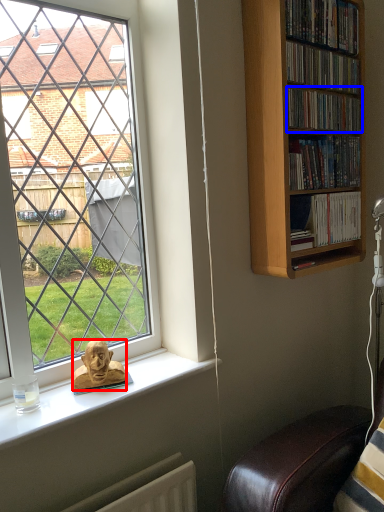
Question: Which point is further to the camera, person (highlighted by a red box) or book (highlighted by a blue box)?

Choices:
 (A) person
 (B) book

Answer: (B)